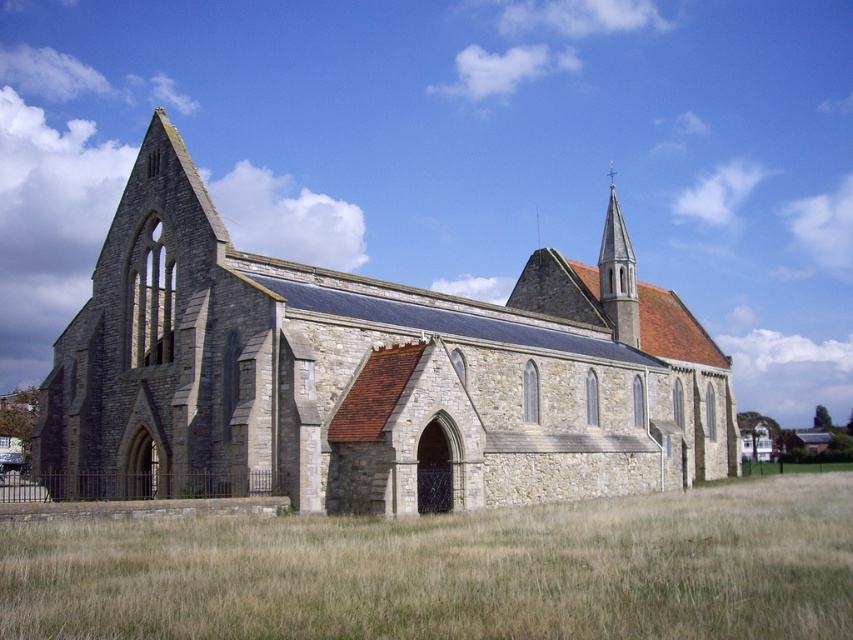
Question: Is brown dry grass at lower center positioned behind smooth gold spire at upper center?

Choices:
 (A) yes
 (B) no

Answer: (B)

Question: Can you confirm if gray stone church at center is positioned above smooth gold spire at upper center?

Choices:
 (A) no
 (B) yes

Answer: (A)

Question: Can you confirm if brown dry grass at lower center is bigger than smooth gold spire at upper center?

Choices:
 (A) no
 (B) yes

Answer: (A)

Question: Which point is closer to the camera taking this photo?

Choices:
 (A) (608, 200)
 (B) (10, 541)
 (C) (438, 358)

Answer: (B)

Question: Among these objects, which one is farthest from the camera?

Choices:
 (A) brown dry grass at lower center
 (B) smooth gold spire at upper center

Answer: (B)

Question: Which object is positioned farthest from the gray stone church at center?

Choices:
 (A) brown dry grass at lower center
 (B) smooth gold spire at upper center

Answer: (B)